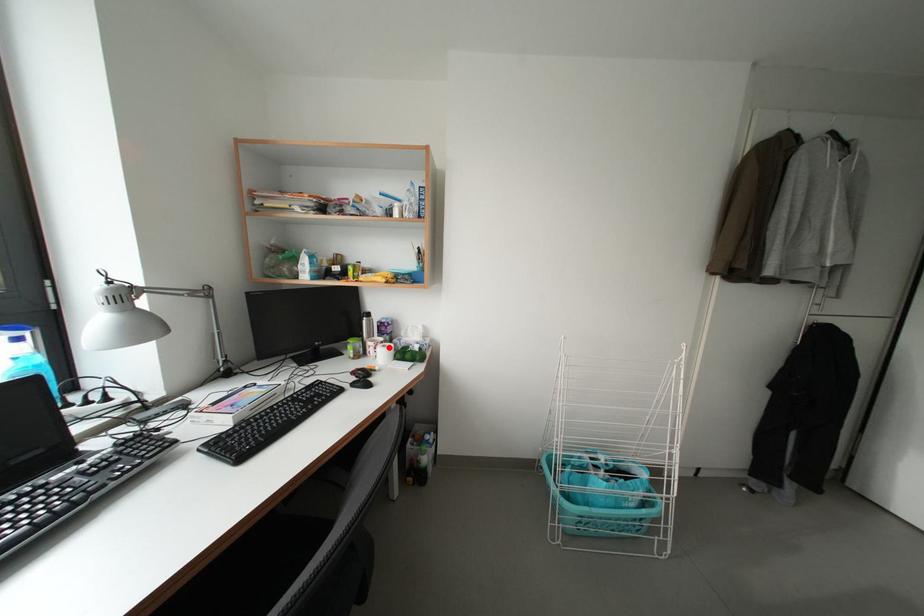
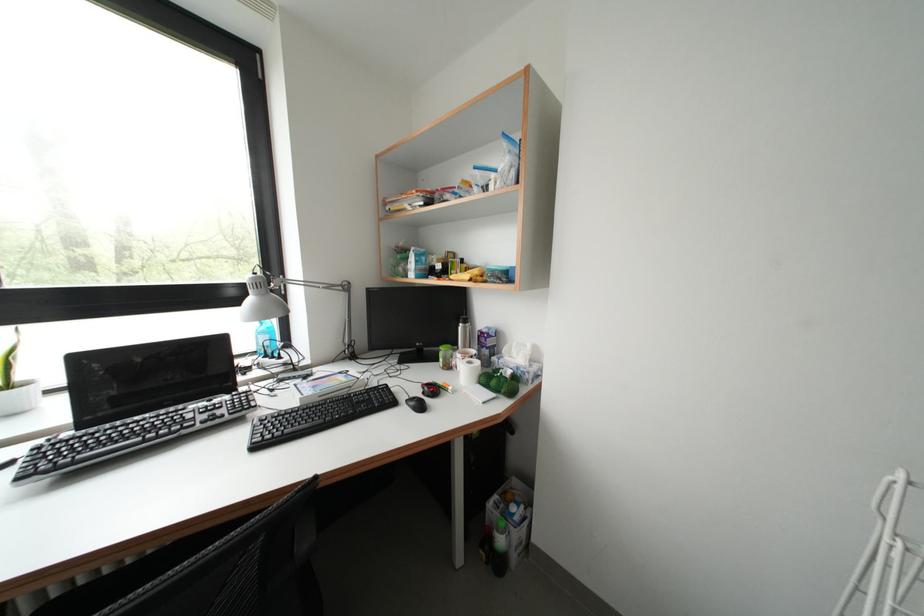
The point at the highlighted location is marked in the first image. Where is the corresponding point in the second image?

(479, 362)